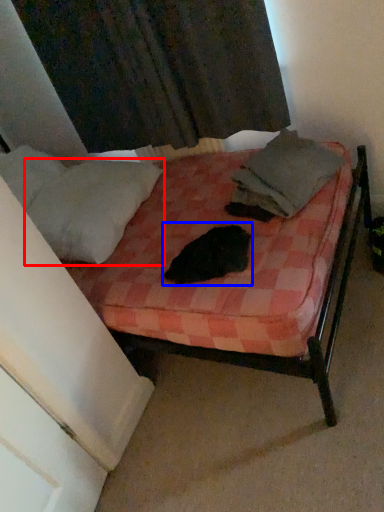
Question: Among these objects, which one is nearest to the camera, pillow (highlighted by a red box) or animal (highlighted by a blue box)?

Choices:
 (A) pillow
 (B) animal

Answer: (B)